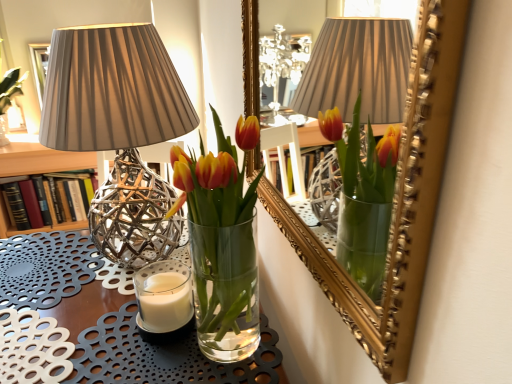
This screenshot has width=512, height=384. I want to click on vacant area that lies between matte silver lamp at left and white wax candle at lower left, so click(105, 313).